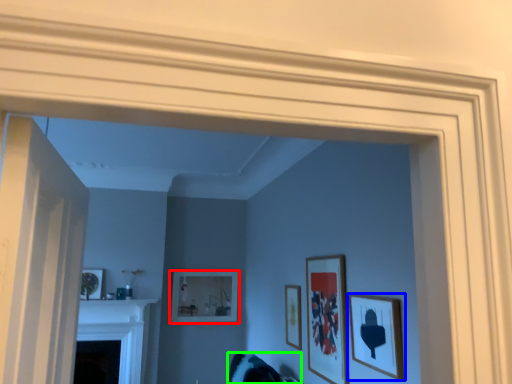
Question: Considering the real-world distances, which object is farthest from picture frame (highlighted by a red box)? picture frame (highlighted by a blue box) or swivel chair (highlighted by a green box)?

Choices:
 (A) picture frame
 (B) swivel chair

Answer: (A)